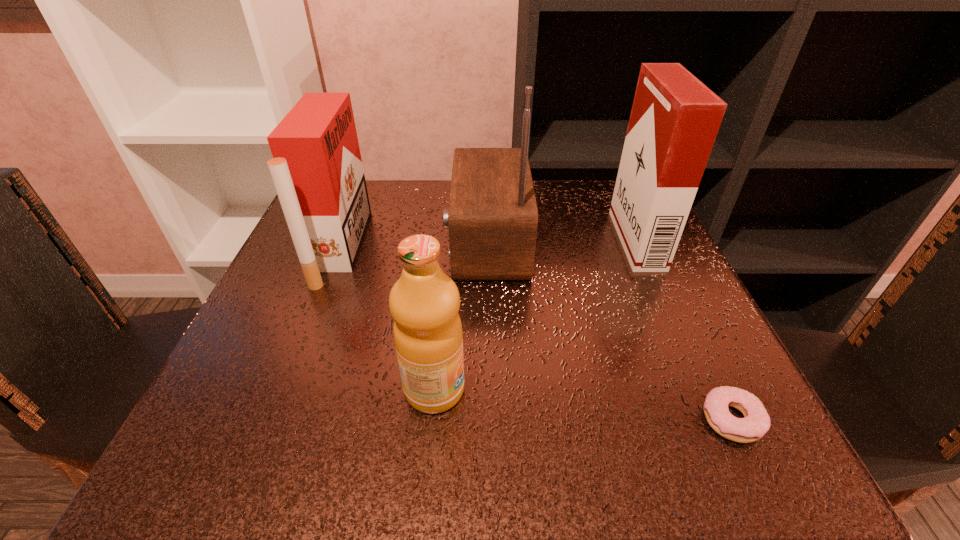
Where is `doughnut that is at the right edge`? doughnut that is at the right edge is located at coordinates (756, 422).

This screenshot has height=540, width=960. Find the location of `object situated at the far left corner`. object situated at the far left corner is located at coordinates (317, 170).

Where is `object present at the far right corner`? object present at the far right corner is located at coordinates (675, 118).

Identify the location of object that is at the near right corner. [756, 422].

The image size is (960, 540). In the image, there is a desktop. Find the location of `vacant space at the far edge`. vacant space at the far edge is located at coordinates (444, 186).

Image resolution: width=960 pixels, height=540 pixels. Find the location of `vacant space at the near edge of the desktop`. vacant space at the near edge of the desktop is located at coordinates (399, 427).

At what (x,y) coordinates should I click in order to perform the action: click on free space at the left edge. Please return your answer as a coordinate pair (x, y). Looking at the image, I should click on (303, 364).

The height and width of the screenshot is (540, 960). I want to click on free space at the right edge, so click(x=628, y=318).

Where is `free region at the far left corner`? This screenshot has width=960, height=540. free region at the far left corner is located at coordinates (369, 230).

Where is `free space at the far right corner of the desktop`? The image size is (960, 540). free space at the far right corner of the desktop is located at coordinates [596, 198].